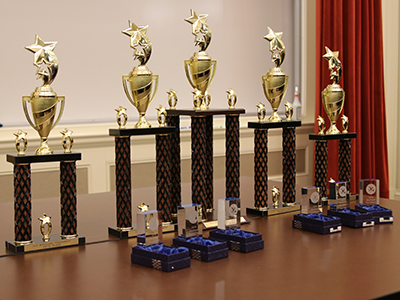
Locate an element on the screen. Image resolution: width=400 pixels, height=300 pixels. beige wall is located at coordinates (387, 60).